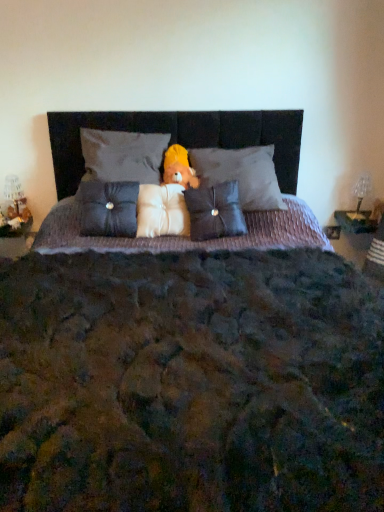
Question: Is satin dark gray pillow at center, positioned as the fourth pillow in left-to-right order, smaller than yellow plush bear at center?

Choices:
 (A) no
 (B) yes

Answer: (A)

Question: Is satin dark gray pillow at center, positioned as the fourth pillow in left-to-right order, thinner than yellow plush bear at center?

Choices:
 (A) no
 (B) yes

Answer: (A)

Question: From a real-world perspective, does satin dark gray pillow at center, positioned as the fourth pillow in left-to-right order, stand above yellow plush bear at center?

Choices:
 (A) yes
 (B) no

Answer: (B)

Question: Considering the relative positions of satin dark gray pillow at center, positioned as the fourth pillow in left-to-right order, and yellow plush bear at center in the image provided, is satin dark gray pillow at center, positioned as the fourth pillow in left-to-right order, behind yellow plush bear at center?

Choices:
 (A) no
 (B) yes

Answer: (A)

Question: Is satin dark gray pillow at center, positioned as the fourth pillow in left-to-right order, oriented towards yellow plush bear at center?

Choices:
 (A) no
 (B) yes

Answer: (A)

Question: Can you confirm if satin dark gray pillow at center, positioned as the fourth pillow in left-to-right order, is positioned to the right of yellow plush bear at center?

Choices:
 (A) no
 (B) yes

Answer: (B)

Question: Are velvet gray pillow at upper center, positioned as the 2th pillow in left-to-right order, and white plush pillow at center, placed as the third pillow when sorted from right to left, far apart?

Choices:
 (A) no
 (B) yes

Answer: (A)

Question: Can you confirm if velvet gray pillow at upper center, which ranks as the 4th pillow in right-to-left order, is smaller than white plush pillow at center, placed as the third pillow when sorted from right to left?

Choices:
 (A) no
 (B) yes

Answer: (A)

Question: From a real-world perspective, is velvet gray pillow at upper center, which ranks as the 4th pillow in right-to-left order, physically below white plush pillow at center, placed as the third pillow when sorted from right to left?

Choices:
 (A) no
 (B) yes

Answer: (A)

Question: Is white plush pillow at center, placed as the third pillow when sorted from left to right, completely or partially inside velvet gray pillow at upper center, positioned as the 2th pillow in left-to-right order?

Choices:
 (A) no
 (B) yes

Answer: (A)

Question: Is white plush pillow at center, placed as the third pillow when sorted from left to right, at the back of velvet gray pillow at upper center, positioned as the 2th pillow in left-to-right order?

Choices:
 (A) yes
 (B) no

Answer: (B)

Question: Does velvet gray pillow at upper center, which ranks as the 4th pillow in right-to-left order, have a lesser height compared to white plush pillow at center, placed as the third pillow when sorted from right to left?

Choices:
 (A) no
 (B) yes

Answer: (B)

Question: From a real-world perspective, is satin dark gray pillow at center, placed as the first pillow when sorted from left to right, below white plush pillow at center, placed as the third pillow when sorted from right to left?

Choices:
 (A) yes
 (B) no

Answer: (B)